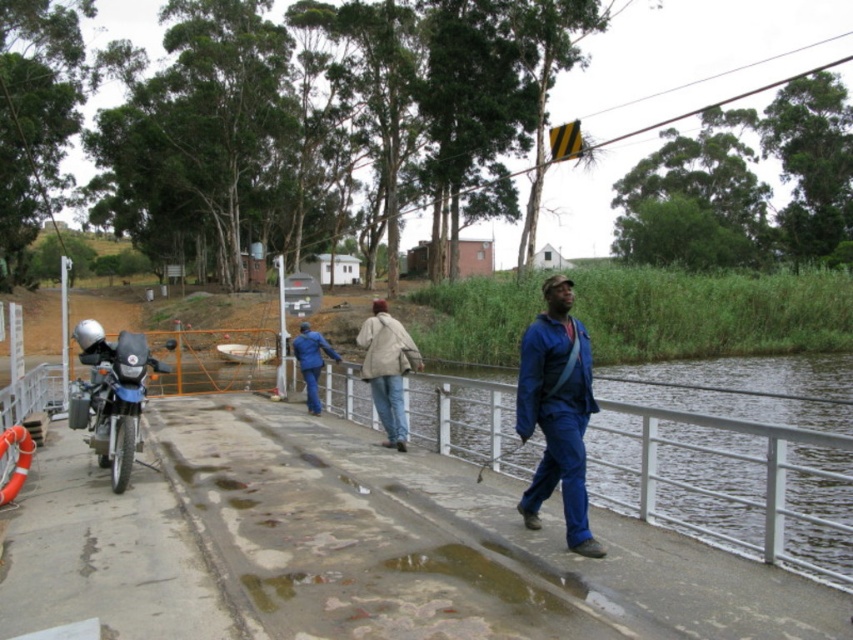
You are planning to park your car next to the matte black motorcycle at left and the beige fabric jacket at center. Which object requires more space due to its width?

The matte black motorcycle at left requires more space because its width is larger than the beige fabric jacket at center.

You are standing at the point marked as point (100, 465) at the river crossing. You want to cross the river using a small boat that can carry up to 10 meters in length. Can you safely reach the boat located at the dock 15 meters away from your current position?

The distance between point (100, 465) and the viewer is 9.34 meters. Since the boat is 15 meters away, it exceeds the boat length capacity of 10 meters. Therefore, you cannot safely reach the boat.